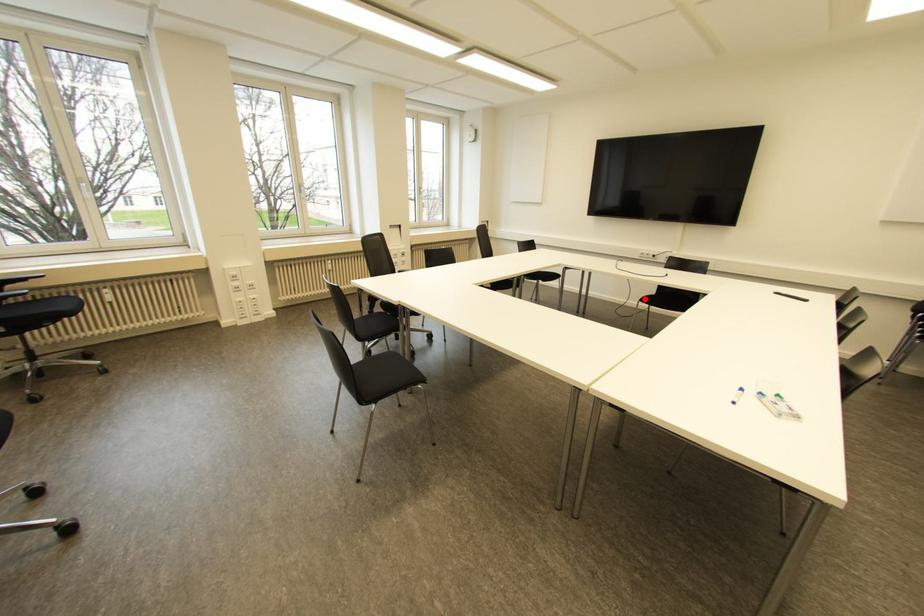
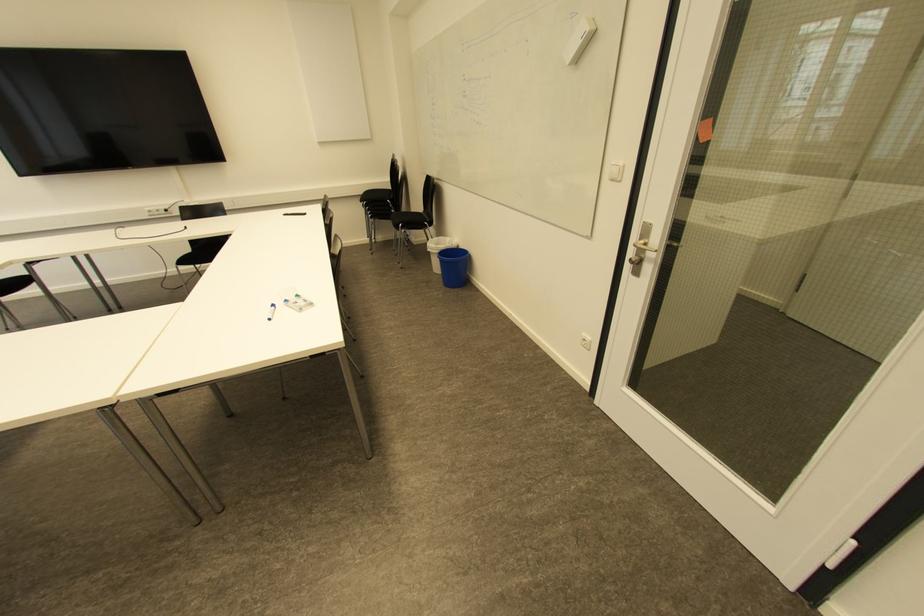
Where in the second image is the point corresponding to the highlighted location from the first image?

(183, 261)